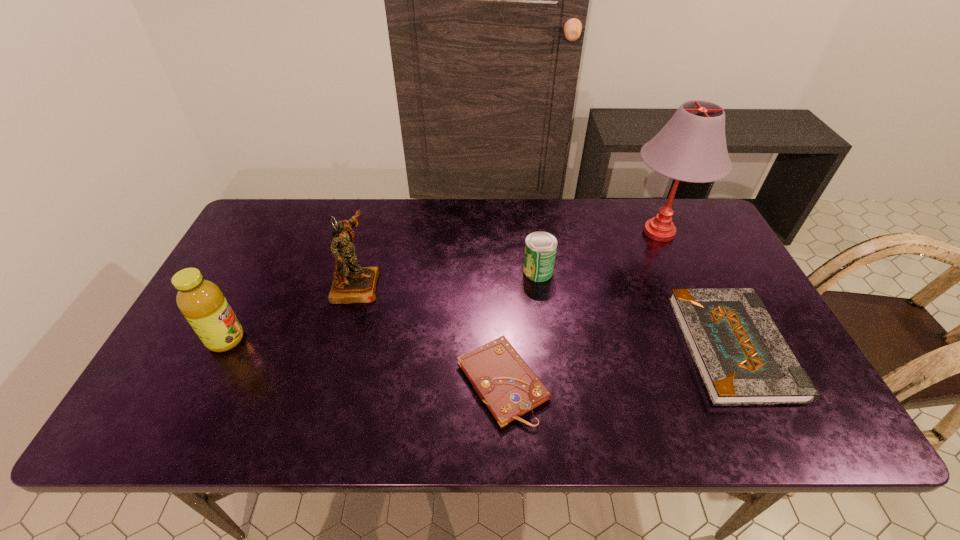
Locate an element on the screen. free point located on the front-facing side of the tallest object is located at coordinates (536, 232).

Where is `free region located on the front-facing side of the tallest object`? This screenshot has width=960, height=540. free region located on the front-facing side of the tallest object is located at coordinates (504, 232).

Where is `blank space located on the front-facing side of the fifth object from right to left`? The image size is (960, 540). blank space located on the front-facing side of the fifth object from right to left is located at coordinates (487, 284).

Where is `vacant region located 0.310m on the front label of the leftmost object`? The image size is (960, 540). vacant region located 0.310m on the front label of the leftmost object is located at coordinates (369, 340).

Find the location of a particular element. Image resolution: width=960 pixels, height=540 pixels. free space located on the front of the fourth tallest object is located at coordinates (547, 339).

The width and height of the screenshot is (960, 540). Identify the location of vacant space located on the left of the right notebook. (544, 347).

Locate an element on the screen. vacant region located on the right of the shorter notebook is located at coordinates (600, 382).

At what (x,y) coordinates should I click in order to perform the action: click on object situated at the far edge. Please return your answer as a coordinate pair (x, y). This screenshot has height=540, width=960. Looking at the image, I should click on (691, 147).

Locate an element on the screen. Image resolution: width=960 pixels, height=540 pixels. object that is at the left edge is located at coordinates (201, 301).

In order to click on table lamp that is at the right edge in this screenshot , I will do `click(691, 147)`.